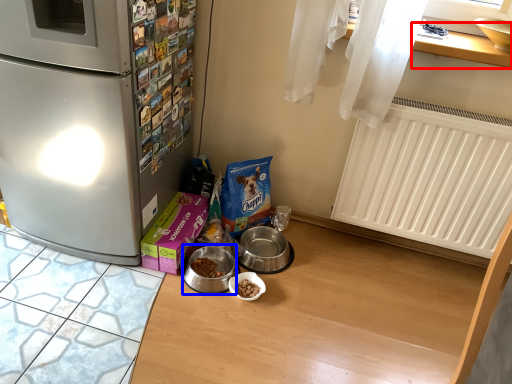
Question: Which object is closer to the camera taking this photo, window sill (highlighted by a red box) or appliance (highlighted by a blue box)?

Choices:
 (A) window sill
 (B) appliance

Answer: (A)